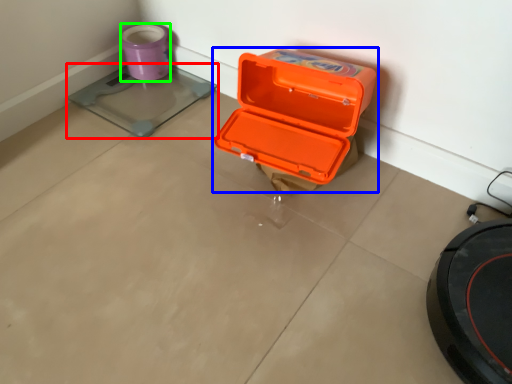
Question: Estimate the real-world distances between objects in this image. Which object is farther from weight scale (highlighted by a red box), box (highlighted by a blue box) or appliance (highlighted by a green box)?

Choices:
 (A) box
 (B) appliance

Answer: (A)